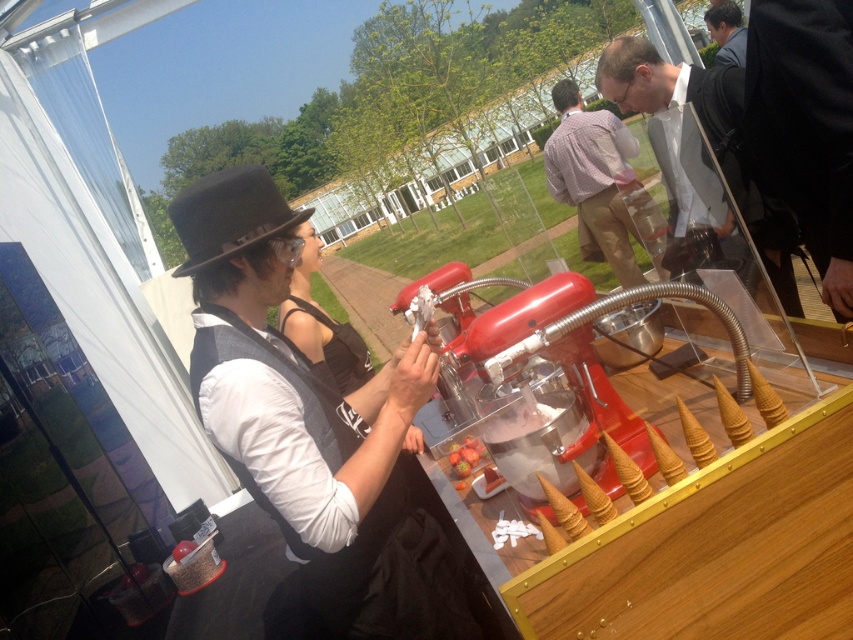
Question: Which object is the farthest from the black satin dress at center?

Choices:
 (A) plaid shirt at center
 (B) matte black jacket at upper right

Answer: (A)

Question: Is plaid shirt at center smaller than smooth black suit at upper right?

Choices:
 (A) yes
 (B) no

Answer: (B)

Question: From the image, what is the correct spatial relationship of black satin dress at center in relation to smooth strawberry at center?

Choices:
 (A) below
 (B) above

Answer: (B)

Question: Based on their relative distances, which object is farther from the plaid shirt at center?

Choices:
 (A) matte black jacket at upper right
 (B) smooth strawberry at center

Answer: (B)

Question: Is matte black jacket at upper right further to the viewer compared to plaid shirt at center?

Choices:
 (A) no
 (B) yes

Answer: (B)

Question: Which object is positioned farthest from the smooth strawberry at center?

Choices:
 (A) black satin dress at center
 (B) plaid shirt at center
 (C) matte black jacket at upper right

Answer: (B)